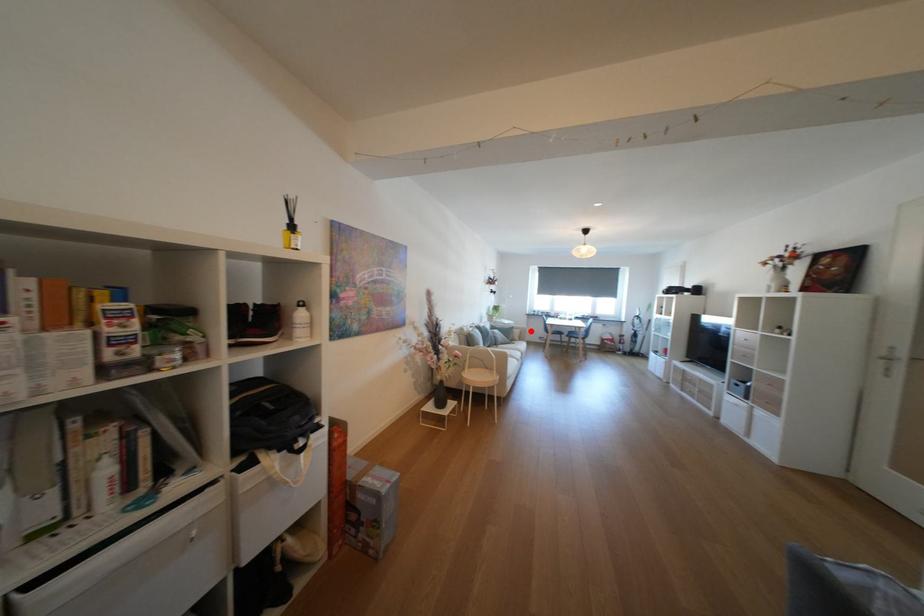
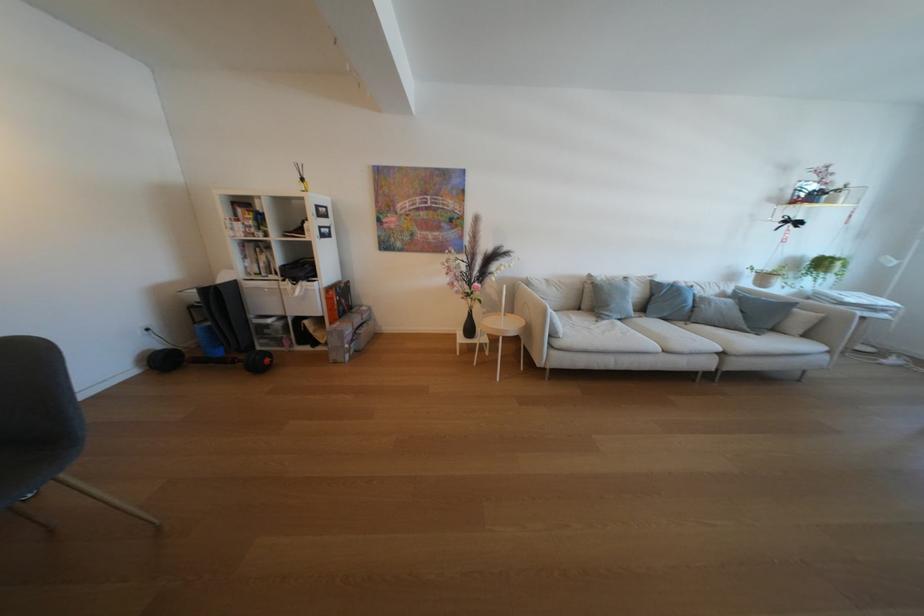
Find the pixel in the second image that matches the highlighted location in the first image.

(833, 315)